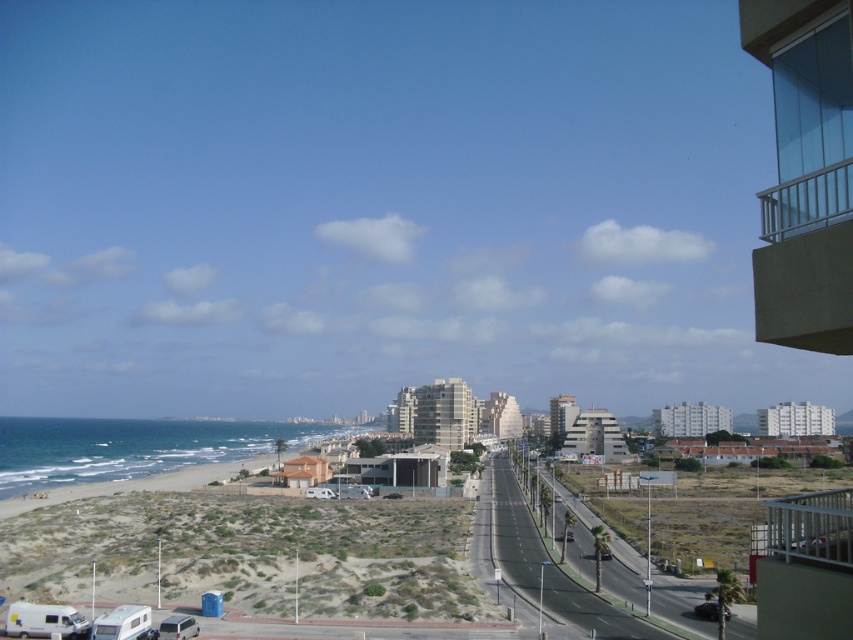
Is metallic silver railing at upper right wider than white matte camper van at lower left?

Yes, metallic silver railing at upper right is wider than white matte camper van at lower left.

Between metallic silver railing at upper right and white matte camper van at lower left, which one is positioned higher?

metallic silver railing at upper right is above.

You are a GUI agent. You are given a task and a screenshot of the screen. Output one action in this format:
    pyautogui.click(x=<x>, y=<y>)
    Task: Click on the metallic silver railing at upper right
    This screenshot has width=853, height=640.
    Given the screenshot: What is the action you would take?
    pyautogui.click(x=811, y=525)

Who is shorter, metallic silver railing at upper right or white matte camper at lower left?

Standing shorter between the two is white matte camper at lower left.

Does point (849, 540) come behind point (135, 620)?

No, it is not.

You are a GUI agent. You are given a task and a screenshot of the screen. Output one action in this format:
    pyautogui.click(x=<x>, y=<y>)
    Task: Click on the metallic silver railing at upper right
    The height and width of the screenshot is (640, 853).
    Given the screenshot: What is the action you would take?
    pyautogui.click(x=811, y=525)

The image size is (853, 640). In order to click on metallic silver railing at upper right in this screenshot , I will do `click(811, 525)`.

Is white matte camper van at lower left to the right of white matte camper at lower left from the viewer's perspective?

Incorrect, white matte camper van at lower left is not on the right side of white matte camper at lower left.

Does white matte camper van at lower left come behind white matte camper at lower left?

Yes, white matte camper van at lower left is further from the viewer.

I want to click on white matte camper van at lower left, so click(45, 620).

Where is `white matte camper van at lower left`? white matte camper van at lower left is located at coordinates (45, 620).